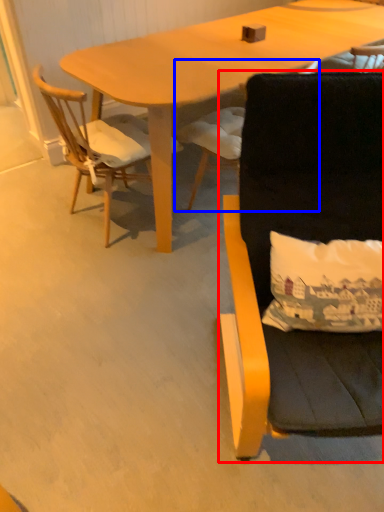
Question: Among these objects, which one is nearest to the camera, chair (highlighted by a red box) or chair (highlighted by a blue box)?

Choices:
 (A) chair
 (B) chair

Answer: (A)